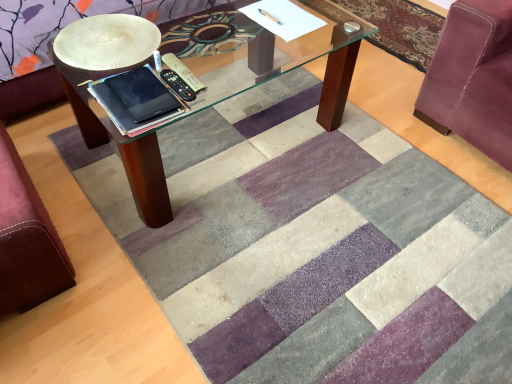
You are a GUI agent. You are given a task and a screenshot of the screen. Output one action in this format:
    pyautogui.click(x=<x>, y=<y>)
    Task: Click on the vacant space situated on the left part of velvet maroon swivel chair at right, placed as the 2th swivel chair when sorted from left to right
    
    Given the screenshot: What is the action you would take?
    pyautogui.click(x=372, y=136)